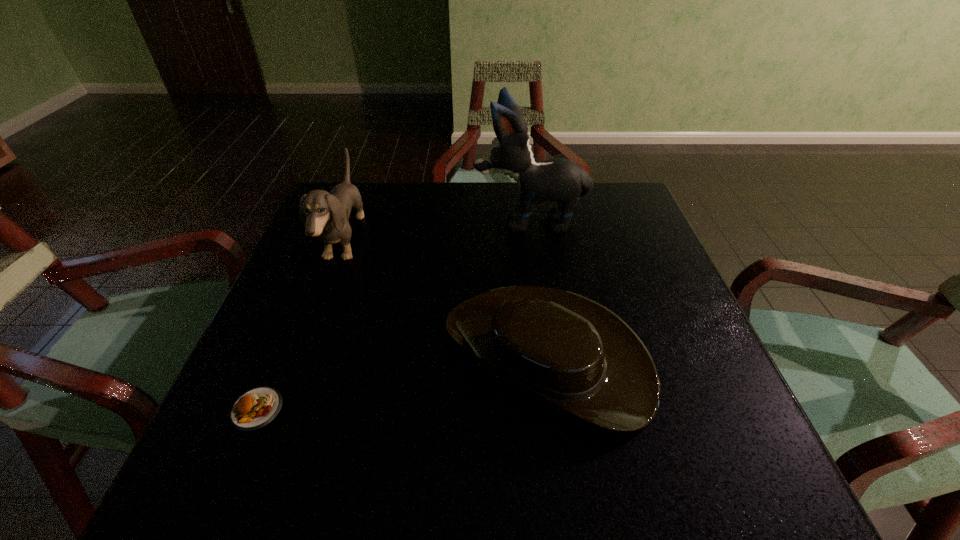
This screenshot has width=960, height=540. In order to click on free spot located 0.240m on the back of the cowboy hat in this screenshot , I will do point(529,225).

You are a GUI agent. You are given a task and a screenshot of the screen. Output one action in this format:
    pyautogui.click(x=<x>, y=<y>)
    Task: Click on the vacant space located on the back of the shortest object
    Image resolution: width=960 pixels, height=540 pixels.
    Given the screenshot: What is the action you would take?
    pyautogui.click(x=307, y=288)

Identify the location of object located at the near edge. This screenshot has width=960, height=540. (563, 350).

Image resolution: width=960 pixels, height=540 pixels. In order to click on puppy located at the left edge in this screenshot , I will do `click(325, 215)`.

At what (x,y) coordinates should I click in order to perform the action: click on patty (food) that is at the left edge. Please return your answer as a coordinate pair (x, y). Looking at the image, I should click on (254, 409).

Find the location of `puppy at the right edge`. puppy at the right edge is located at coordinates (558, 179).

This screenshot has width=960, height=540. In order to click on cowboy hat at the right edge in this screenshot , I will do `click(563, 350)`.

At what (x,y) coordinates should I click in order to perform the action: click on object located in the far left corner section of the desktop. Please return your answer as a coordinate pair (x, y). Image resolution: width=960 pixels, height=540 pixels. Looking at the image, I should click on (325, 215).

I want to click on object that is at the far right corner, so click(x=558, y=179).

Image resolution: width=960 pixels, height=540 pixels. In order to click on object at the near right corner in this screenshot , I will do point(563,350).